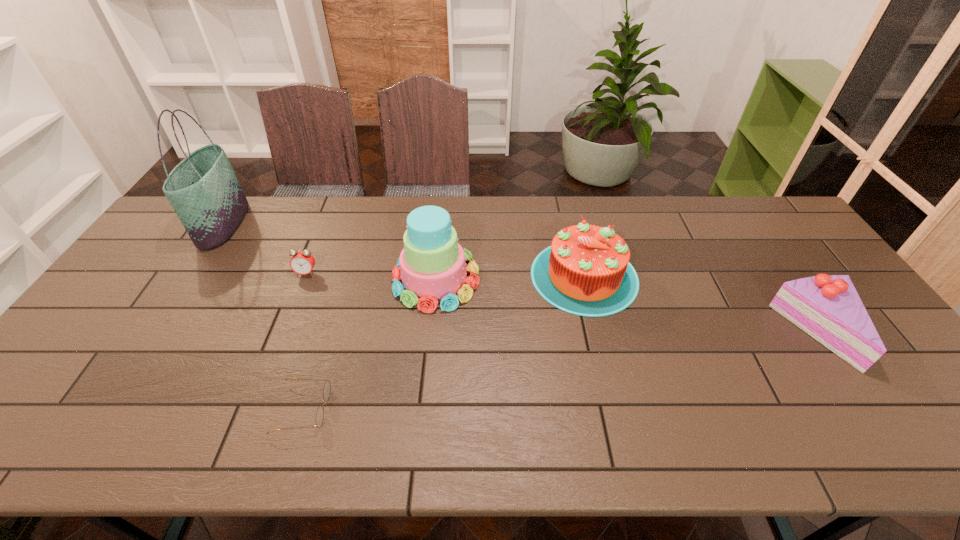
What are the coordinates of `free space between the leftmost cake and the fifth object from right to left` in the screenshot? It's located at (372, 276).

Where is `free space between the tallest object and the shortest object`? free space between the tallest object and the shortest object is located at coordinates (264, 316).

You are a GUI agent. You are given a task and a screenshot of the screen. Output one action in this format:
    pyautogui.click(x=<x>, y=<y>)
    Task: Click on the free spot between the second cake from left to right and the fifth shortest object
    
    Given the screenshot: What is the action you would take?
    pyautogui.click(x=510, y=278)

This screenshot has width=960, height=540. I want to click on free space that is in between the second cake from left to right and the rightmost cake, so (x=703, y=305).

I want to click on free spot between the rightmost object and the second tallest object, so click(628, 306).

I want to click on empty location between the third object from right to left and the second cake from left to right, so click(x=510, y=278).

Where is `the fifth closest object to the second cake from left to right`? the fifth closest object to the second cake from left to right is located at coordinates (203, 189).

Locate an element on the screen. The height and width of the screenshot is (540, 960). object that is the fifth closest to the second tallest object is located at coordinates (827, 307).

This screenshot has height=540, width=960. I want to click on cake that can be found as the closest to the leftmost cake, so click(586, 271).

Identify which cake is the second nearest to the second tallest cake. Please provide its 2D coordinates. Your answer should be formatted as a tuple, i.e. [(x, y)], where the tuple contains the x and y coordinates of a point satisfying the conditions above.

[(827, 307)]